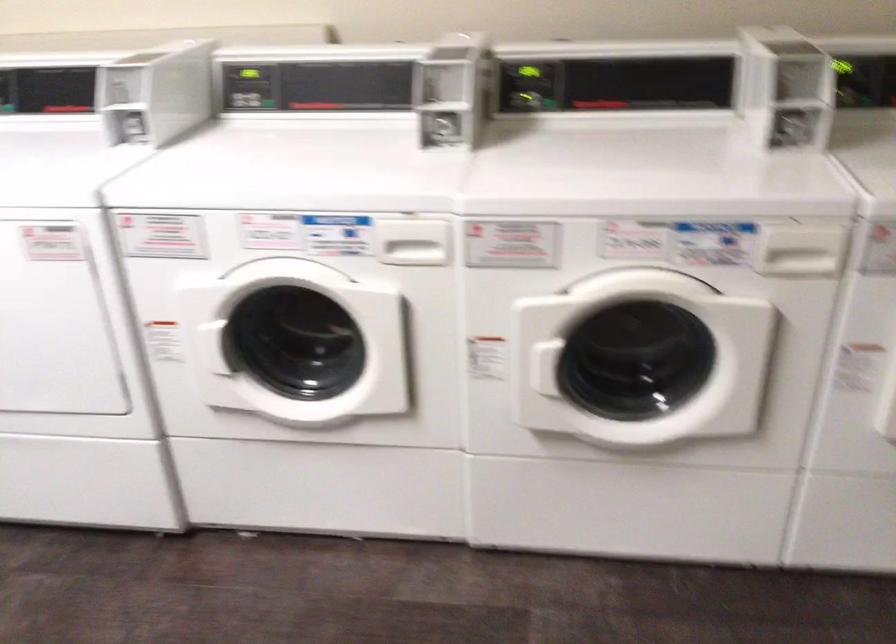
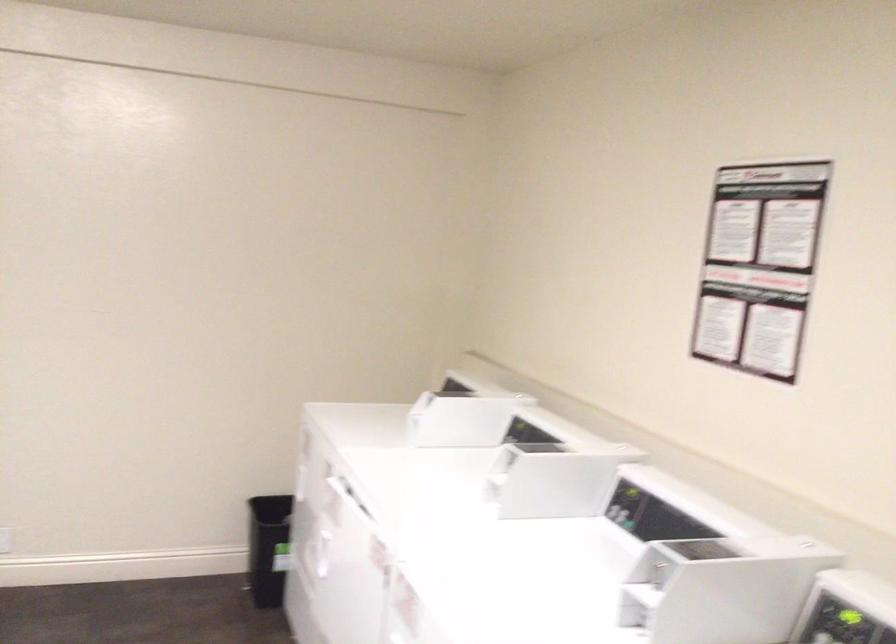
In the second image, find the point that corresponds to point (133, 106) in the first image.

(643, 597)